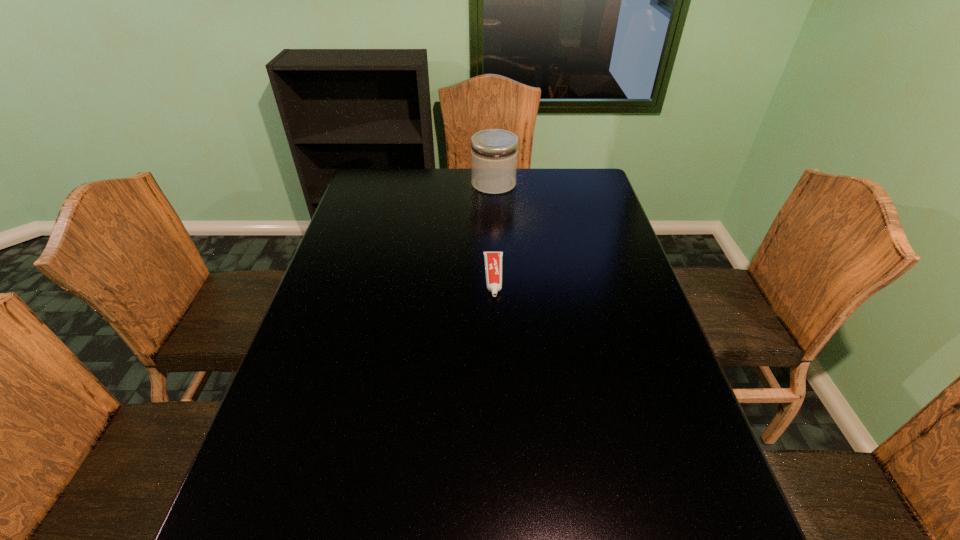
Find the location of a particular element. The image size is (960, 540). the taller object is located at coordinates (494, 152).

Find the location of a particular element. This screenshot has height=540, width=960. the farther object is located at coordinates (494, 152).

Where is `the shorter object`? the shorter object is located at coordinates (493, 260).

Where is `the nearer object`? the nearer object is located at coordinates (493, 260).

Identify the location of vacant space located on the front of the farther object. The width and height of the screenshot is (960, 540). (496, 239).

Where is `vacant space located 0.290m at the nozzle of the shorter object`? This screenshot has height=540, width=960. vacant space located 0.290m at the nozzle of the shorter object is located at coordinates (497, 392).

The width and height of the screenshot is (960, 540). In order to click on object that is at the far edge in this screenshot , I will do `click(494, 152)`.

This screenshot has height=540, width=960. Identify the location of blank space at the far edge of the desktop. (460, 177).

Identify the location of free spot at the left edge of the desktop. Image resolution: width=960 pixels, height=540 pixels. (299, 367).

The image size is (960, 540). In order to click on free spot at the right edge of the desktop in this screenshot , I will do click(676, 511).